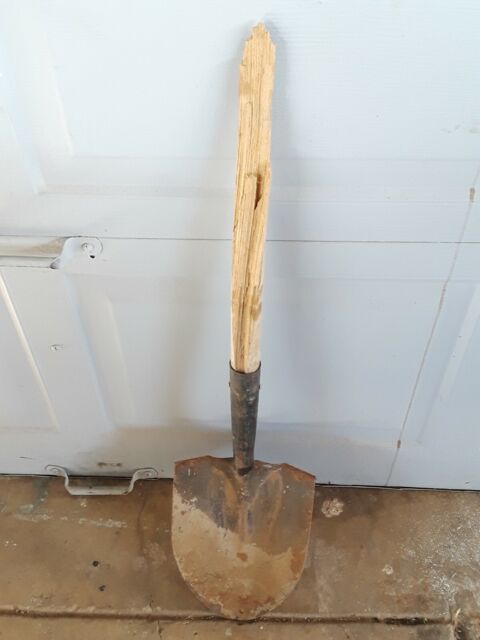
Locate an element on the screen. The height and width of the screenshot is (640, 480). handle is located at coordinates (46, 266), (89, 493).